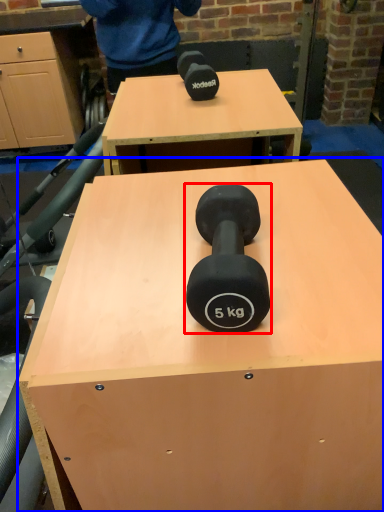
Question: Which of the following is the farthest to the observer, dumbbell (highlighted by a red box) or table (highlighted by a blue box)?

Choices:
 (A) dumbbell
 (B) table

Answer: (B)